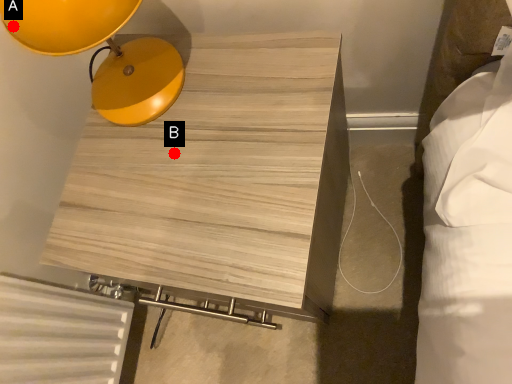
Question: Two points are circled on the image, labeled by A and B beside each circle. Which point appears farthest from the camera in this image?

Choices:
 (A) A is further
 (B) B is further

Answer: (B)